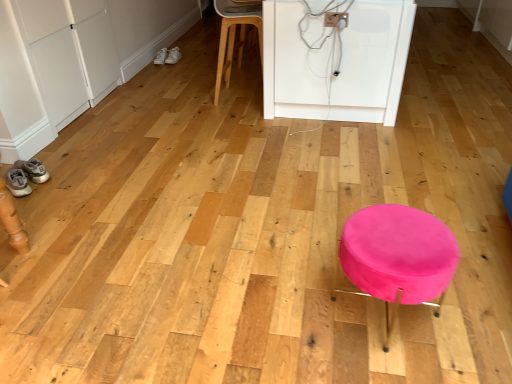
Question: Is light wood stool at center completely or partially inside matte gray sneakers at lower left, which is the third footwear in top-to-bottom order?

Choices:
 (A) yes
 (B) no

Answer: (B)

Question: Is matte gray sneakers at lower left, positioned as the first footwear in front-to-back order, far away from light wood stool at center?

Choices:
 (A) no
 (B) yes

Answer: (B)

Question: Is matte gray sneakers at lower left, positioned as the 3th footwear in right-to-left order, located outside light wood stool at center?

Choices:
 (A) yes
 (B) no

Answer: (A)

Question: Can you confirm if matte gray sneakers at lower left, positioned as the 1th footwear in bottom-to-top order, is positioned to the right of light wood stool at center?

Choices:
 (A) no
 (B) yes

Answer: (A)

Question: Is matte gray sneakers at lower left, which is the third footwear in top-to-bottom order, in contact with light wood stool at center?

Choices:
 (A) no
 (B) yes

Answer: (A)

Question: Can you confirm if matte gray sneakers at lower left, which appears as the first footwear when viewed from the left, is shorter than light wood stool at center?

Choices:
 (A) no
 (B) yes

Answer: (B)

Question: Can you confirm if white leather sneakers at upper left, which is the third footwear in left-to-right order, is wider than white leather sneakers at upper left, the second footwear in the back-to-front sequence?

Choices:
 (A) yes
 (B) no

Answer: (A)

Question: Can you confirm if white leather sneakers at upper left, which ranks as the first footwear in right-to-left order, is positioned to the left of white leather sneakers at upper left, the second footwear in the back-to-front sequence?

Choices:
 (A) no
 (B) yes

Answer: (A)

Question: From a real-world perspective, is white leather sneakers at upper left, placed as the 3th footwear when sorted from front to back, over white leather sneakers at upper left, the 2th footwear positioned from the top?

Choices:
 (A) no
 (B) yes

Answer: (B)

Question: Is white leather sneakers at upper left, which ranks as the first footwear in back-to-front order, behind white leather sneakers at upper left, the second footwear from the bottom?

Choices:
 (A) yes
 (B) no

Answer: (A)

Question: Is white leather sneakers at upper left, placed as the 1th footwear when sorted from top to bottom, positioned before white leather sneakers at upper left, the second footwear from the bottom?

Choices:
 (A) no
 (B) yes

Answer: (A)

Question: Is white leather sneakers at upper left, which ranks as the first footwear in right-to-left order, at the right side of white leather sneakers at upper left, the 2th footwear positioned from the top?

Choices:
 (A) no
 (B) yes

Answer: (B)

Question: From a real-world perspective, is white leather sneakers at upper left, the second footwear viewed from the right, under light wood stool at center?

Choices:
 (A) yes
 (B) no

Answer: (A)